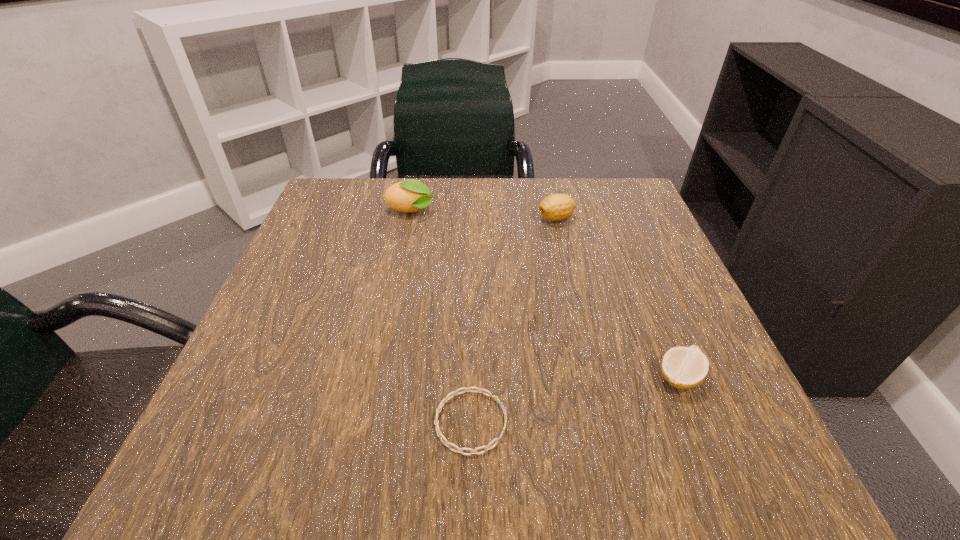
You are a GUI agent. You are given a task and a screenshot of the screen. Output one action in this format:
    pyautogui.click(x=<x>, y=<y>)
    Task: Click on the vacant point located 0.210m at the stem end of the second tallest object
    
    Given the screenshot: What is the action you would take?
    pyautogui.click(x=444, y=219)

The image size is (960, 540). Find the location of `vacant region located at the stem end of the second tallest object`. vacant region located at the stem end of the second tallest object is located at coordinates (421, 219).

Find the location of a particular element. Image resolution: width=960 pixels, height=540 pixels. vacant space located on the left of the second shortest object is located at coordinates (525, 377).

Find the location of a particular element. free space located 0.230m on the surface of the third object from right to left showing star-shaped elements is located at coordinates (670, 422).

At what (x,y) coordinates should I click in order to perform the action: click on object located in the near edge section of the desktop. Please return your answer as a coordinate pair (x, y). Image resolution: width=960 pixels, height=540 pixels. Looking at the image, I should click on (459, 450).

The width and height of the screenshot is (960, 540). What are the coordinates of `object located in the left edge section of the desktop` in the screenshot? It's located at (411, 195).

The image size is (960, 540). What are the coordinates of `object that is at the right edge` in the screenshot? It's located at (684, 368).

Image resolution: width=960 pixels, height=540 pixels. What are the coordinates of `object at the far left corner` in the screenshot? It's located at (411, 195).

At what (x,y) coordinates should I click in order to perform the action: click on vacant region at the far edge of the desktop. Please return your answer as a coordinate pair (x, y). The image size is (960, 540). Looking at the image, I should click on (518, 190).

Image resolution: width=960 pixels, height=540 pixels. Find the location of `free space at the near edge of the desktop`. free space at the near edge of the desktop is located at coordinates (456, 476).